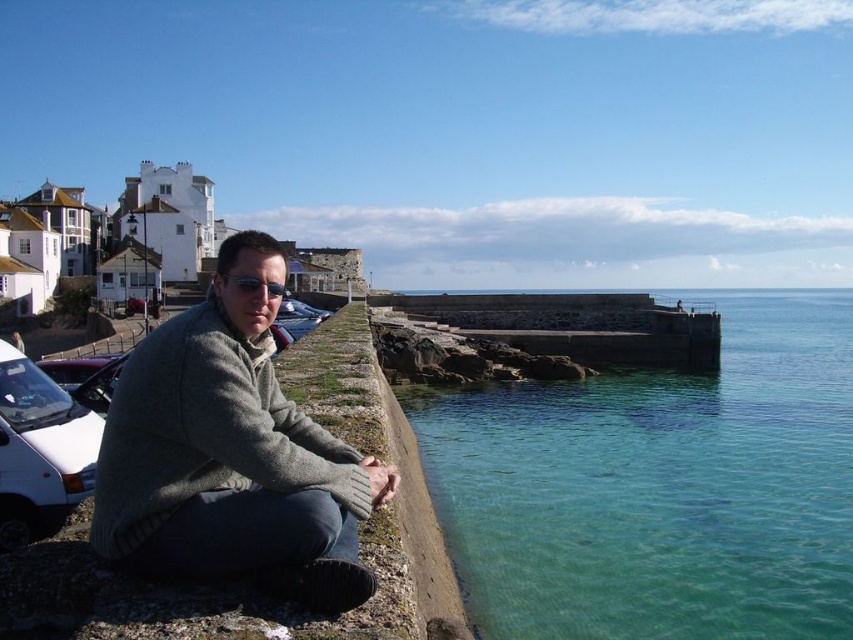
You are a photographer standing at the edge of the coastal scene. You want to capture a shot of the gray wool sweater at center without the clear glass water at lower right appearing in the background. Is this possible based on their positions?

The clear glass water at lower right is positioned over the gray wool sweater at center, so it will be in the background of the sweater. Therefore, it might be challenging to avoid capturing the water in the background when photographing the sweater.

You are a photographer planning to capture the clear glass water at lower right and the gray wool sweater at center in a single frame. Which object should you focus on first to ensure both are in sharp focus, considering their sizes?

The clear glass water at lower right has a larger size compared to the gray wool sweater at center, so you should focus on the clear glass water at lower right first to ensure both are in sharp focus.

From the picture: You are standing at the center of the image and want to take a photo of the clear glass water at lower right. Which direction should you move to get a better view of it?

You should move to the right side of the image to get a better view of the clear glass water at lower right.